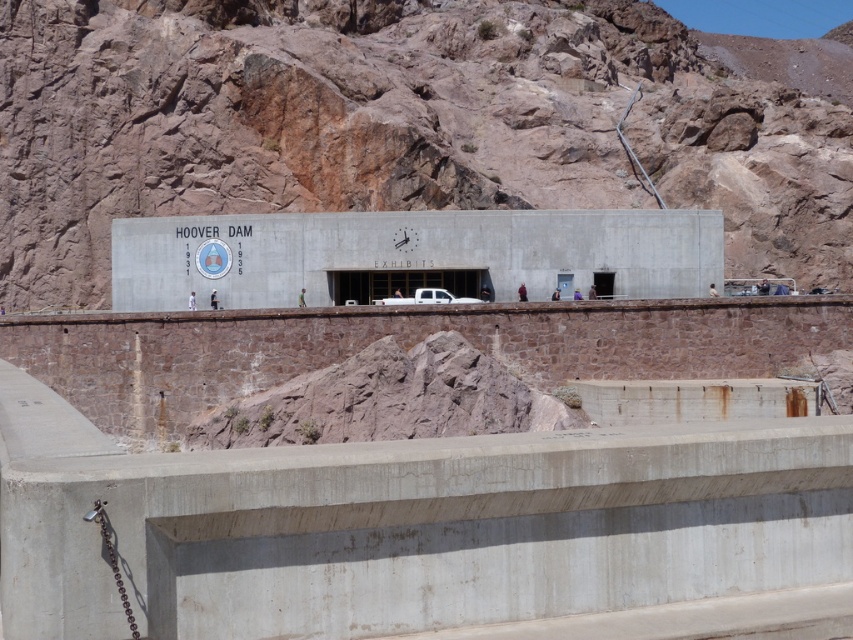
You are a photographer planning to take a photo of the Hoover Dam. You want to ensure both the rustic rock mountain at upper center and the white matte truck at center are visible in the frame. Based on their sizes, which object should you prioritize positioning closer to the camera to include both in the composition?

The rustic rock mountain at upper center is larger in size than the white matte truck at center. To include both in the composition, prioritize positioning the white matte truck at center closer to the camera since it is smaller and might otherwise be overwhelmed by the larger mountain in the background.

You are standing at the base of the Hoover Dam and want to take a photo that includes both the rustic rock mountain at upper center and the clock on the wall. Given that your camera has a maximum zoom range of 100 meters, will you be able to capture both elements in the same frame without moving closer?

The rustic rock mountain at upper center is 93.48 meters away from the camera. Since the camera can zoom up to 100 meters, you can capture both the rustic rock mountain at upper center and the clock on the wall in the same frame without moving closer.